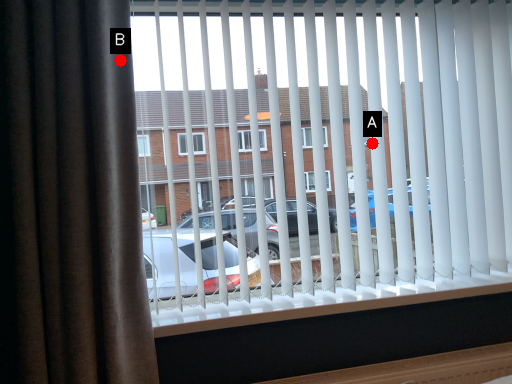
Question: Two points are circled on the image, labeled by A and B beside each circle. Which point is farther to the camera?

Choices:
 (A) A is further
 (B) B is further

Answer: (A)